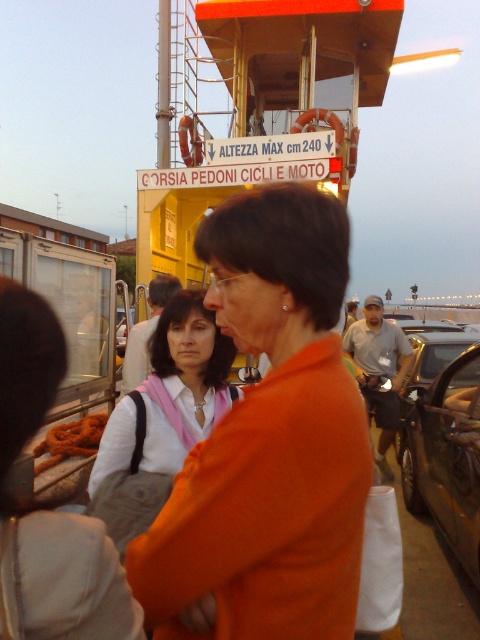
Does orange fabric bag at center come behind shiny black car at lower right?

No, orange fabric bag at center is closer to the viewer.

Image resolution: width=480 pixels, height=640 pixels. I want to click on orange fabric bag at center, so click(x=48, y=509).

Between orange fabric at center and yellow matte ferry at upper center, which one appears on the left side from the viewer's perspective?

orange fabric at center

The height and width of the screenshot is (640, 480). Find the location of `orange fabric at center`. orange fabric at center is located at coordinates (268, 442).

Identify the location of orange fabric at center. The height and width of the screenshot is (640, 480). (268, 442).

Between orange fabric at center and shiny black car at center right, which one is positioned higher?

Positioned higher is orange fabric at center.

Does orange fabric at center have a smaller size compared to shiny black car at center right?

Yes.

Which is in front, point (260, 304) or point (411, 371)?

Point (260, 304) is in front.

Where is `orange fabric at center`? The height and width of the screenshot is (640, 480). orange fabric at center is located at coordinates (268, 442).